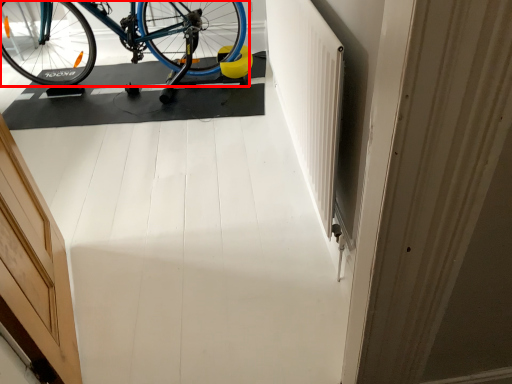
Question: In this image, where is bicycle (annotated by the red box) located relative to door?

Choices:
 (A) right
 (B) left

Answer: (B)